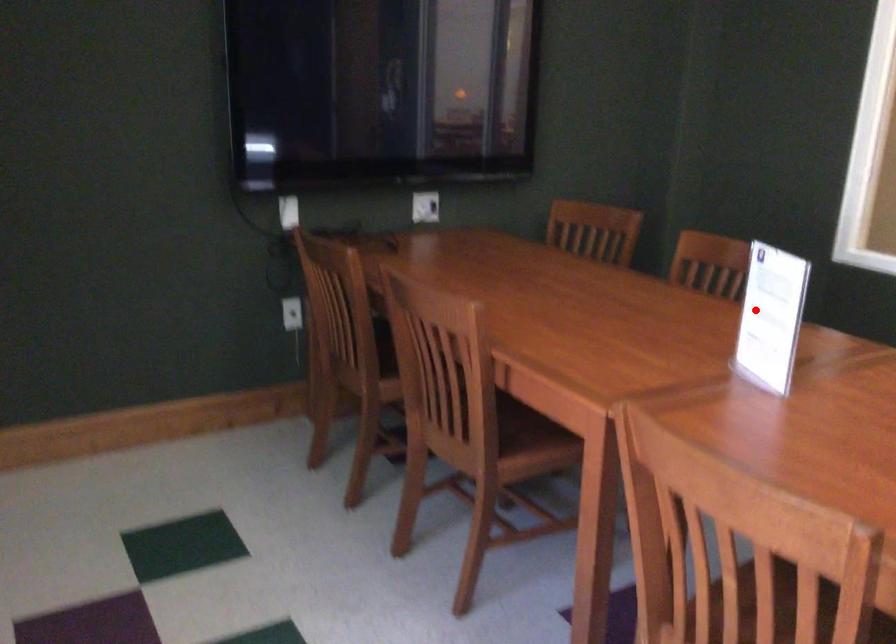
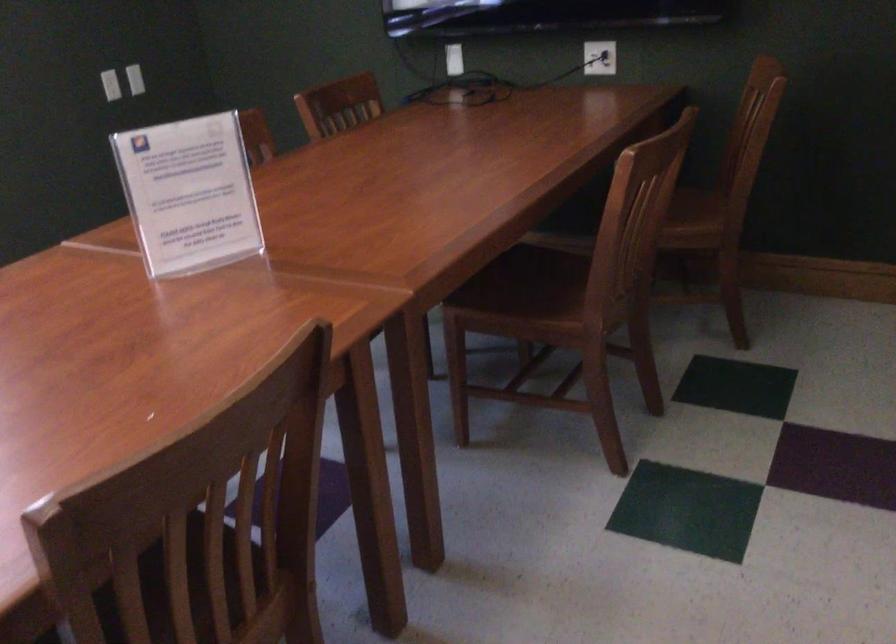
Question: I am providing you with two images of the same scene from different viewpoints. In image1, a red point is highlighted. Considering the same 3D point in image2, which of the following is correct?

Choices:
 (A) It is closer
 (B) It is farther

Answer: (A)